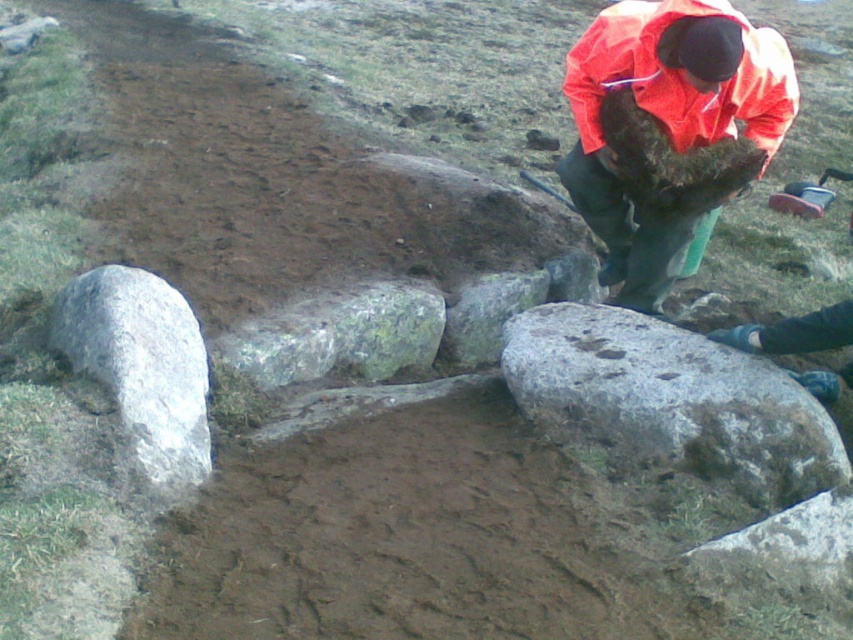
Based on the photo, which is above, gray rough stone at center or orange waterproof jacket at upper right?

orange waterproof jacket at upper right

Who is positioned more to the right, gray rough stone at center or orange waterproof jacket at upper right?

From the viewer's perspective, orange waterproof jacket at upper right appears more on the right side.

What do you see at coordinates (669, 403) in the screenshot? This screenshot has width=853, height=640. I see `gray rough stone at center` at bounding box center [669, 403].

At what (x,y) coordinates should I click in order to perform the action: click on gray rough stone at center. Please return your answer as a coordinate pair (x, y). The image size is (853, 640). Looking at the image, I should click on (669, 403).

Between point (567, 442) and point (155, 460), which one is positioned behind?

Positioned behind is point (567, 442).

Who is higher up, gray rough stone at center or gray rough rock at lower left?

gray rough rock at lower left

Which is behind, point (566, 353) or point (149, 348)?

The point (566, 353) is more distant.

Where is `gray rough stone at center`? Image resolution: width=853 pixels, height=640 pixels. gray rough stone at center is located at coordinates (669, 403).

Is point (601, 77) positioned in front of point (94, 314)?

No, (601, 77) is behind (94, 314).

Between point (717, 68) and point (189, 333), which one is positioned behind?

The point (189, 333) is more distant.

The height and width of the screenshot is (640, 853). Find the location of `orange waterproof jacket at upper right`. orange waterproof jacket at upper right is located at coordinates (666, 120).